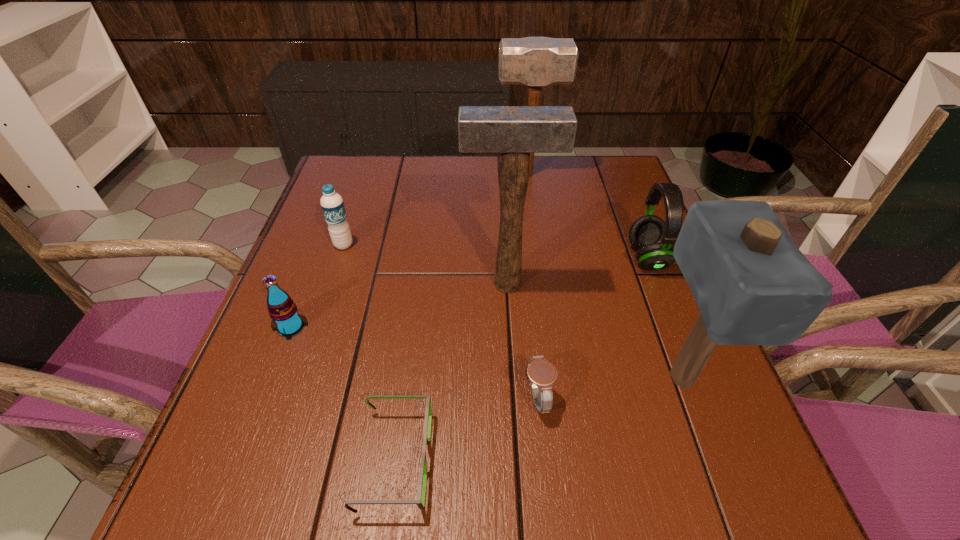
At what (x,y) coordinates should I click in order to perform the action: click on free space that is in between the water bottle and the sixth tallest object. Please return your answer as a coordinate pair (x, y). The height and width of the screenshot is (540, 960). Looking at the image, I should click on (317, 286).

In order to click on vacant space in between the second farthest mallet and the headset in this screenshot , I will do `click(577, 271)`.

Locate which object is the fifth closest to the rightmost mallet. Please provide its 2D coordinates. Your answer should be formatted as a tuple, i.e. [(x, y)], where the tuple contains the x and y coordinates of a point satisfying the conditions above.

[(532, 61)]

The height and width of the screenshot is (540, 960). In order to click on object that stands as the fourth closest to the second nearest mallet in this screenshot , I will do `click(332, 204)`.

I want to click on mallet that is the second nearest to the sixth tallest object, so 532,61.

The height and width of the screenshot is (540, 960). Find the location of `mallet that stands as the closest to the soda`. mallet that stands as the closest to the soda is located at coordinates (514, 131).

This screenshot has width=960, height=540. Find the location of `blank space that satisfies the following two spatial constraints: 1. on the front side of the second farthest mallet; 2. on the right side of the rightmost mallet`. blank space that satisfies the following two spatial constraints: 1. on the front side of the second farthest mallet; 2. on the right side of the rightmost mallet is located at coordinates (513, 377).

Find the location of a particular element. The width and height of the screenshot is (960, 540). vacant region that satisfies the following two spatial constraints: 1. on the label of the watch; 2. on the right side of the water bottle is located at coordinates tap(293, 399).